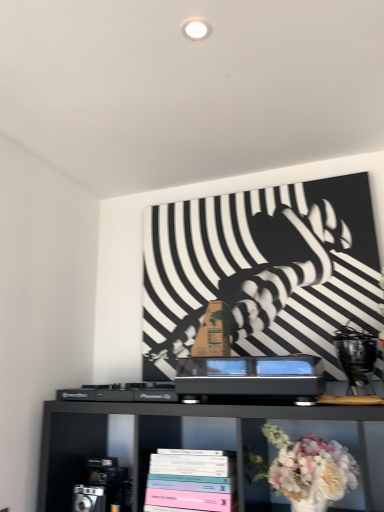
Question: Is pastel floral bouquet at lower right to the left or to the right of pastel matte books at lower center in the image?

Choices:
 (A) left
 (B) right

Answer: (B)

Question: Considering the positions of pastel floral bouquet at lower right and pastel matte books at lower center in the image, is pastel floral bouquet at lower right taller or shorter than pastel matte books at lower center?

Choices:
 (A) short
 (B) tall

Answer: (B)

Question: Considering the positions of pastel floral bouquet at lower right and pastel matte books at lower center in the image, is pastel floral bouquet at lower right bigger or smaller than pastel matte books at lower center?

Choices:
 (A) big
 (B) small

Answer: (B)

Question: Does point (201, 478) appear closer or farther from the camera than point (296, 478)?

Choices:
 (A) farther
 (B) closer

Answer: (A)

Question: From a real-world perspective, is pastel matte books at lower center above or below pastel floral bouquet at lower right?

Choices:
 (A) above
 (B) below

Answer: (B)

Question: Is pastel matte books at lower center taller or shorter than pastel floral bouquet at lower right?

Choices:
 (A) short
 (B) tall

Answer: (A)

Question: In the image, is pastel matte books at lower center on the left side or the right side of pastel floral bouquet at lower right?

Choices:
 (A) left
 (B) right

Answer: (A)